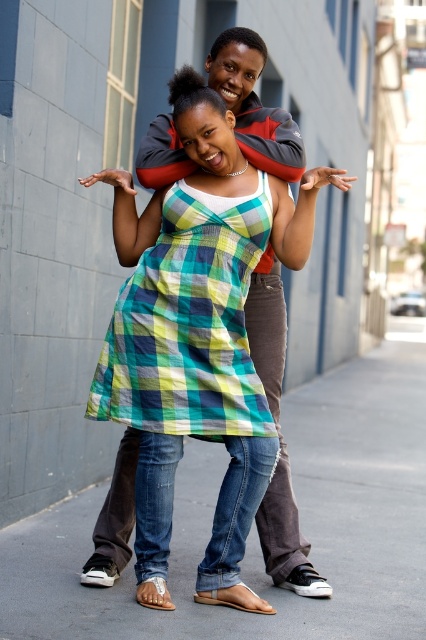
You are a photographer standing 10 feet away from the camera. You want to take a photo of the green plaid dress at center. Can you reach the dress within your current position to adjust it before taking the photo?

The green plaid dress at center and camera are 12.83 feet apart from each other. Since you are standing 10 feet away from the camera, the distance between you and the dress is 12.83 feet minus 10 feet, which equals 2.83 feet. You can easily reach the green plaid dress at center within that distance to adjust it before taking the photo.

You are a photographer setting up a tripod to capture the two people in the image. You need to place the tripod on the smooth concrete pavement at center without blocking the view of the green plaid dress at center. Is this possible?

The smooth concrete pavement at center is below the green plaid dress at center, so placing the tripod on the pavement would not block the view of the dress as it is positioned lower.

You are trying to determine the order of the two people in the image based on their positions. Which person is closer to the camera, the one at point (167,372) or the one at point (201,170)?

The person at point (167,372) is closer to the camera because the description states that point (167,372) is in front of point (201,170).